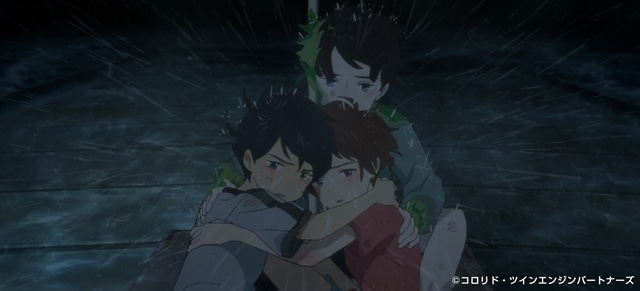
The image size is (640, 291). In order to click on wooden slats in background in this screenshot , I will do pyautogui.click(x=134, y=209), pyautogui.click(x=118, y=268), pyautogui.click(x=141, y=169).